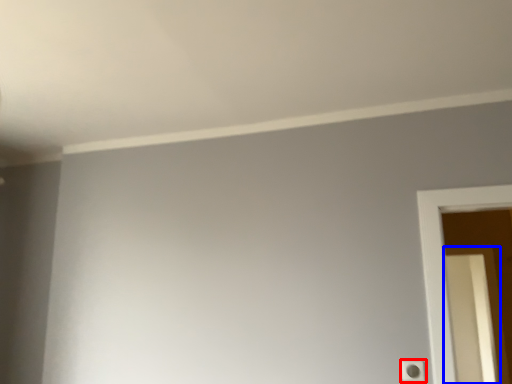
Question: Which point is closer to the camera, light switch (highlighted by a red box) or screen door (highlighted by a blue box)?

Choices:
 (A) light switch
 (B) screen door

Answer: (A)